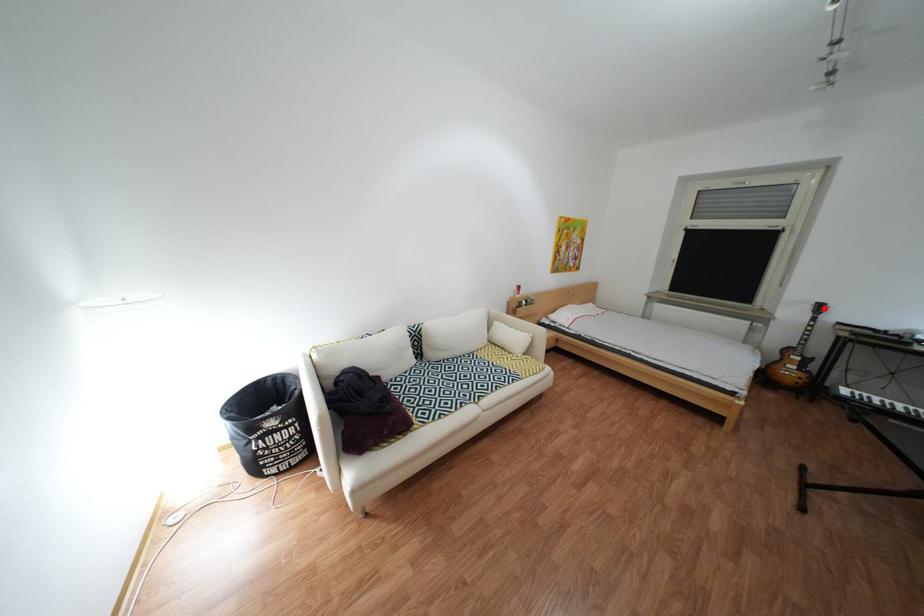
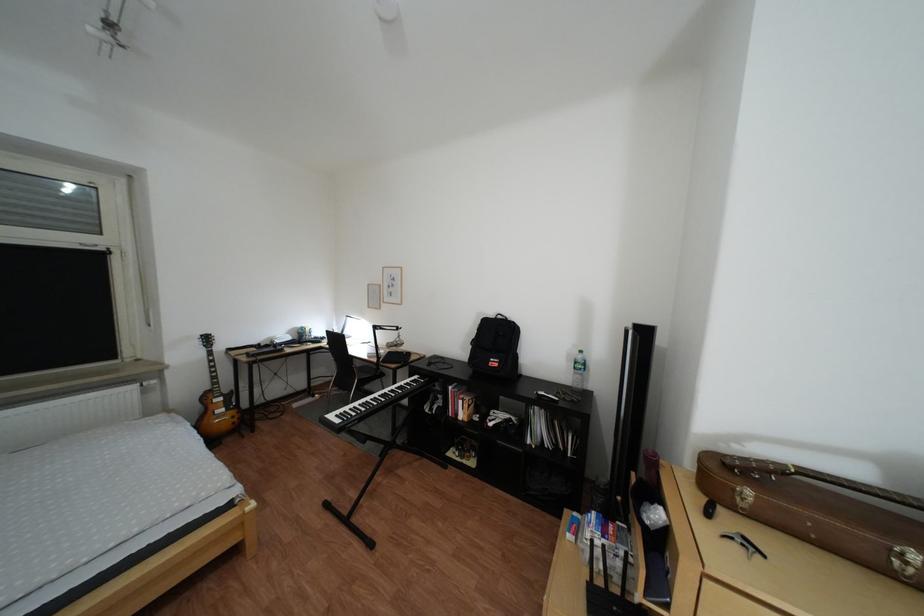
Locate, in the second image, the point that corresponds to the highlighted location in the first image.

(213, 344)